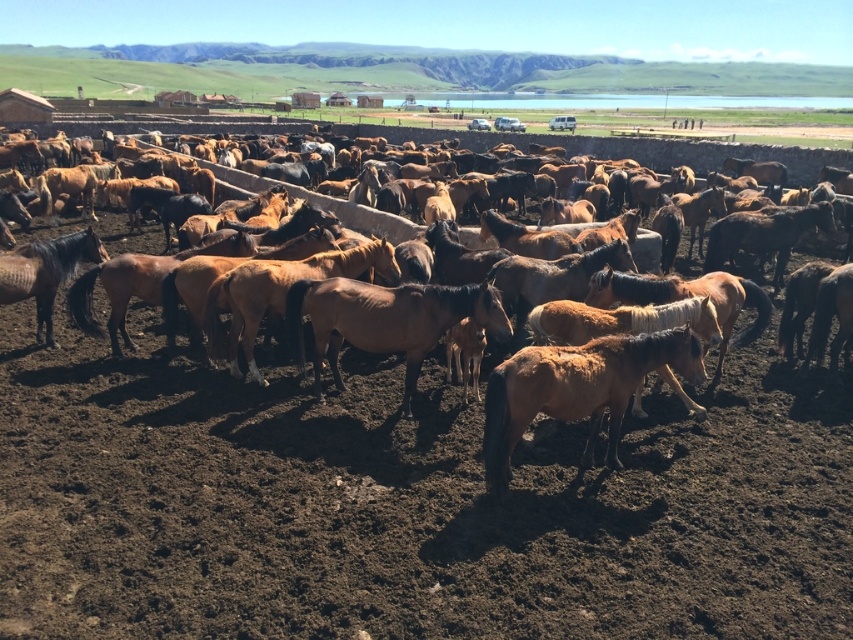
Question: Is brown textured horse at center to the left of brown matte horse at center from the viewer's perspective?

Choices:
 (A) no
 (B) yes

Answer: (B)

Question: Is brown textured horse at center positioned behind brown matte horse at center?

Choices:
 (A) no
 (B) yes

Answer: (B)

Question: Which of the following is the farthest from the observer?

Choices:
 (A) (734, 413)
 (B) (607, 339)

Answer: (A)

Question: Does brown textured horse at center have a lesser width compared to brown matte horse at center?

Choices:
 (A) yes
 (B) no

Answer: (A)

Question: Which point appears farthest from the camera in this image?

Choices:
 (A) (335, 397)
 (B) (695, 349)

Answer: (A)